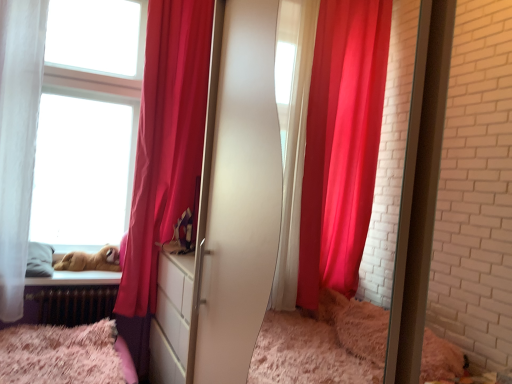
Question: Does fluffy pink bed at lower left touch brown plush toy at lower left?

Choices:
 (A) no
 (B) yes

Answer: (A)

Question: Is fluffy pink bed at lower left bigger than brown plush toy at lower left?

Choices:
 (A) yes
 (B) no

Answer: (A)

Question: From a real-world perspective, is fluffy pink bed at lower left under brown plush toy at lower left?

Choices:
 (A) no
 (B) yes

Answer: (B)

Question: Can you confirm if fluffy pink bed at lower left is thinner than brown plush toy at lower left?

Choices:
 (A) yes
 (B) no

Answer: (A)

Question: From the image's perspective, does fluffy pink bed at lower left appear higher than brown plush toy at lower left?

Choices:
 (A) no
 (B) yes

Answer: (A)

Question: From a real-world perspective, is fluffy pink bed at lower left located higher than brown plush toy at lower left?

Choices:
 (A) no
 (B) yes

Answer: (A)

Question: Is brown plush toy at lower left oriented away from fluffy pink bed at lower left?

Choices:
 (A) no
 (B) yes

Answer: (A)

Question: Is fluffy pink bed at lower left surrounded by brown plush toy at lower left?

Choices:
 (A) yes
 (B) no

Answer: (B)

Question: From the image's perspective, does brown plush toy at lower left appear higher than fluffy pink bed at lower left?

Choices:
 (A) no
 (B) yes

Answer: (B)

Question: From a real-world perspective, is brown plush toy at lower left located beneath fluffy pink bed at lower left?

Choices:
 (A) yes
 (B) no

Answer: (B)

Question: Can you confirm if brown plush toy at lower left is positioned to the right of fluffy pink bed at lower left?

Choices:
 (A) no
 (B) yes

Answer: (B)

Question: Is brown plush toy at lower left further to camera compared to fluffy pink bed at lower left?

Choices:
 (A) no
 (B) yes

Answer: (B)

Question: Is fluffy pink bed at lower left at the left side of silky red curtain at left?

Choices:
 (A) no
 (B) yes

Answer: (B)